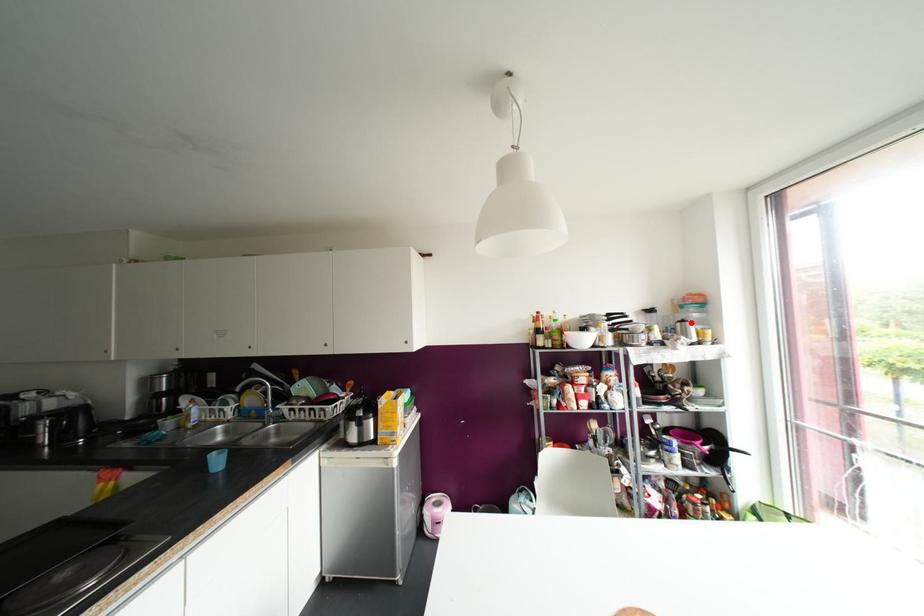
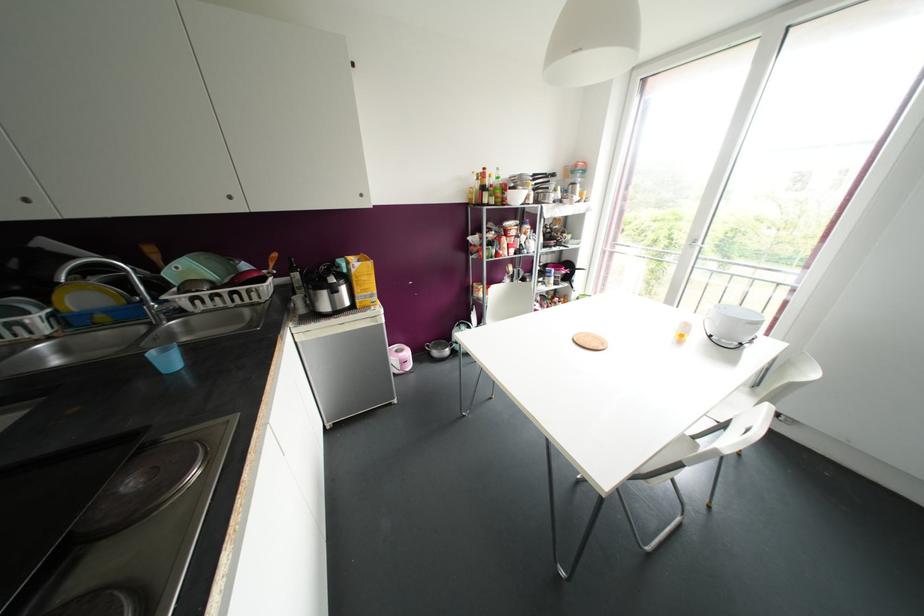
Question: I am providing you with two images of the same scene from different viewpoints. Image1 has a red point marked. In image2, the corresponding 3D location appears at what relative position? Reply with the corresponding letter.

Choices:
 (A) Closer
 (B) Farther

Answer: (A)